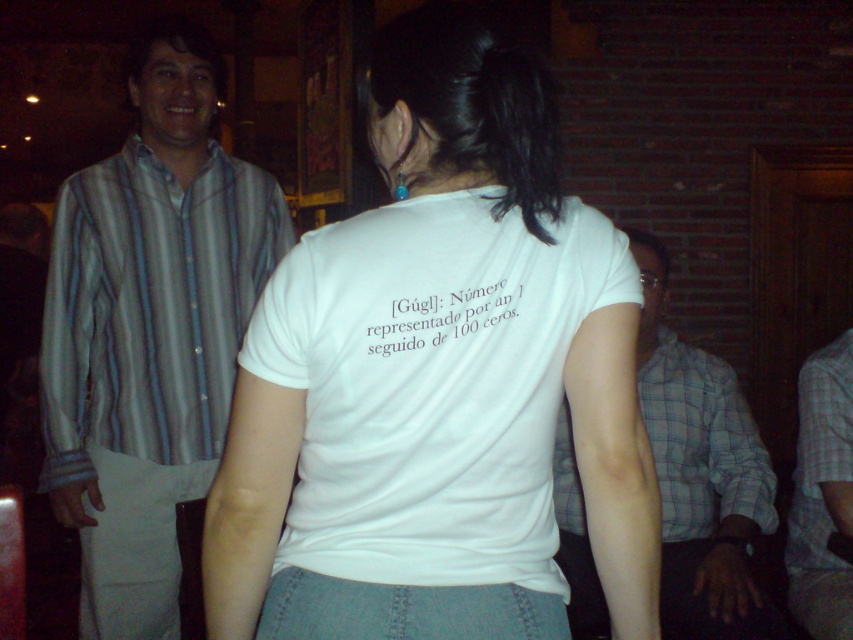
Question: Which point appears farthest from the camera in this image?

Choices:
 (A) (88, 339)
 (B) (834, 586)
 (C) (770, 500)

Answer: (C)

Question: Is white matte t-shirt at center positioned at the back of plaid fabric shirt at right?

Choices:
 (A) no
 (B) yes

Answer: (A)

Question: Where is striped cotton shirt at left located in relation to plaid fabric shirt at right in the image?

Choices:
 (A) below
 (B) above

Answer: (B)

Question: Is white matte t-shirt at center to the right of plaid cotton shirt at right from the viewer's perspective?

Choices:
 (A) no
 (B) yes

Answer: (A)

Question: Which point is farther from the camera taking this photo?

Choices:
 (A) (671, 604)
 (B) (805, 452)
 (C) (538, 140)

Answer: (B)

Question: Which point appears farthest from the camera in this image?

Choices:
 (A) (671, 547)
 (B) (807, 451)

Answer: (A)